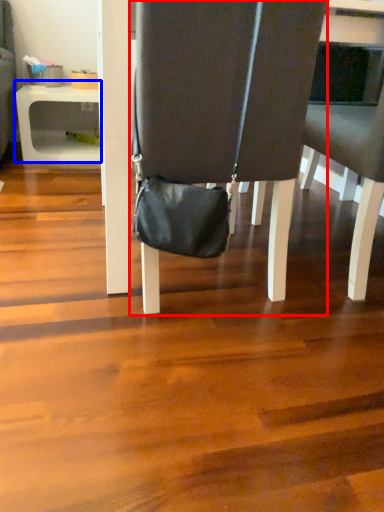
Question: Which object is further to the camera taking this photo, chair (highlighted by a red box) or table (highlighted by a blue box)?

Choices:
 (A) chair
 (B) table

Answer: (B)